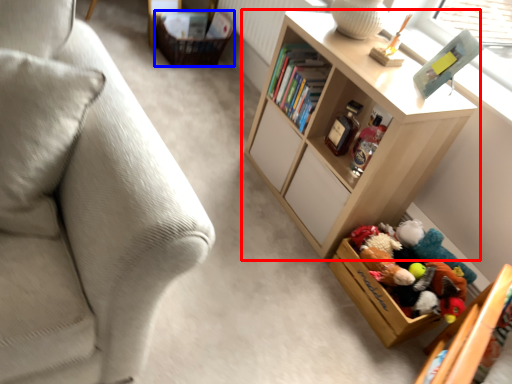
Question: Which point is closer to the camera, shelf (highlighted by a red box) or storage box (highlighted by a blue box)?

Choices:
 (A) shelf
 (B) storage box

Answer: (A)